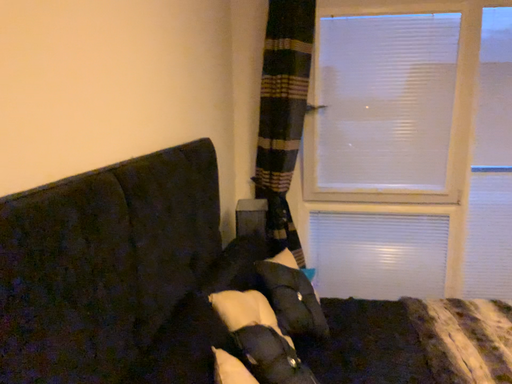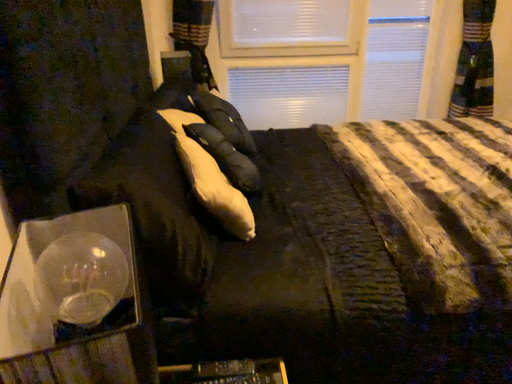
Question: Which way did the camera rotate in the video?

Choices:
 (A) rotated left
 (B) rotated right

Answer: (B)